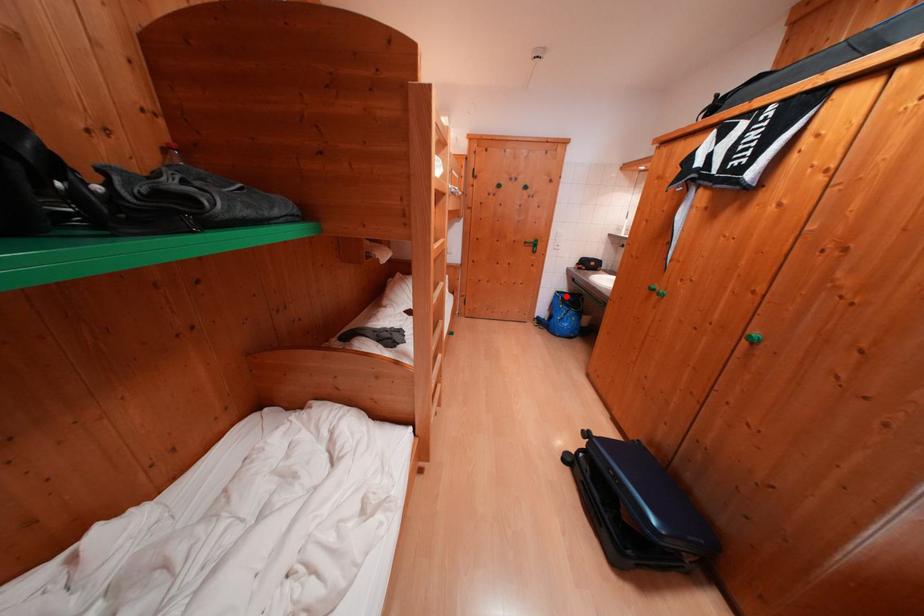
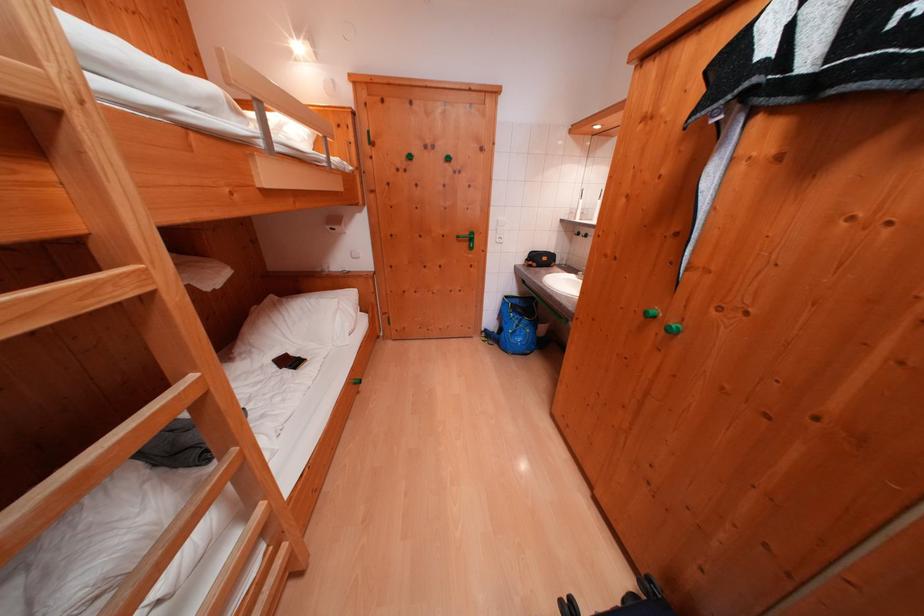
Locate, in the second image, the point that corresponds to the highlighted location in the first image.

(515, 301)